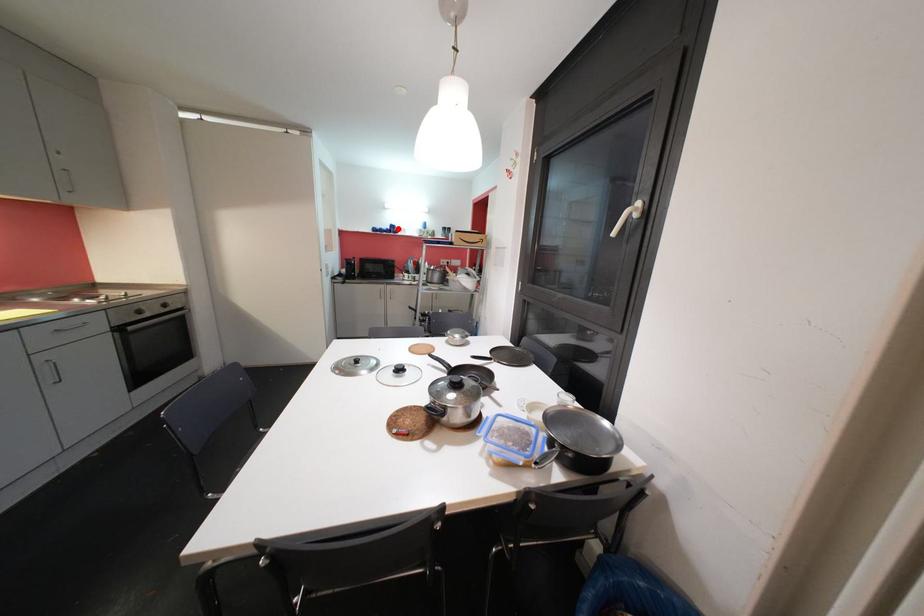
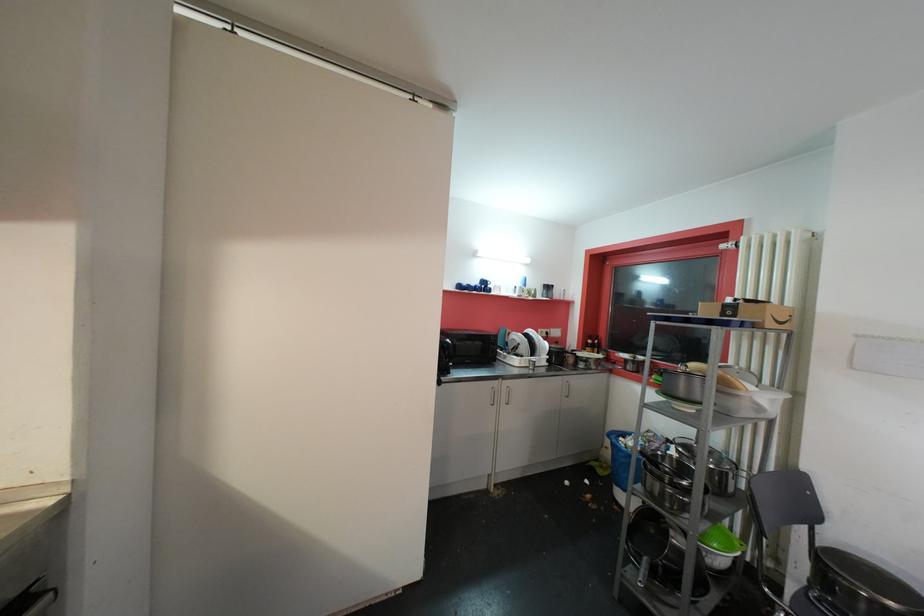
The point at the highlighted location is marked in the first image. Where is the corresponding point in the second image?

(489, 285)